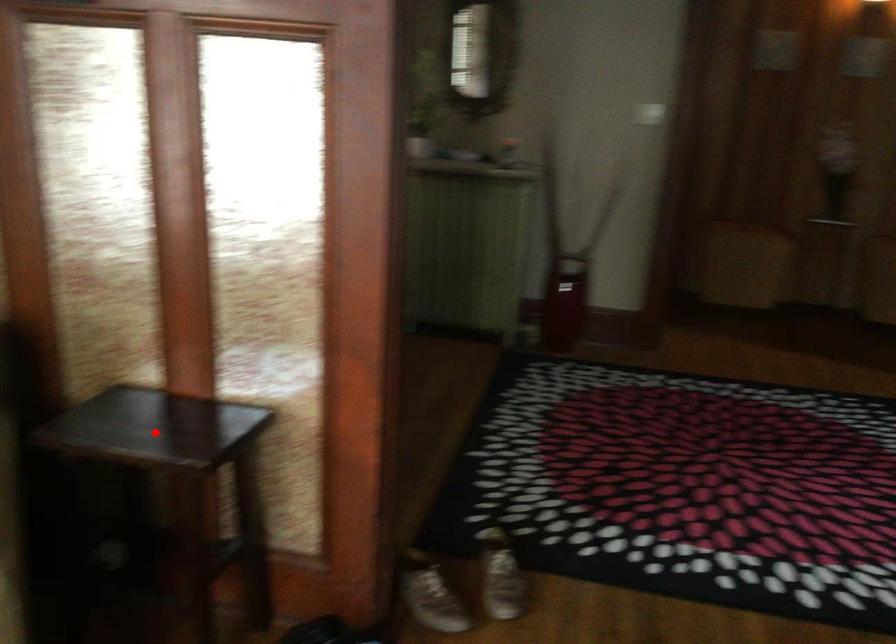
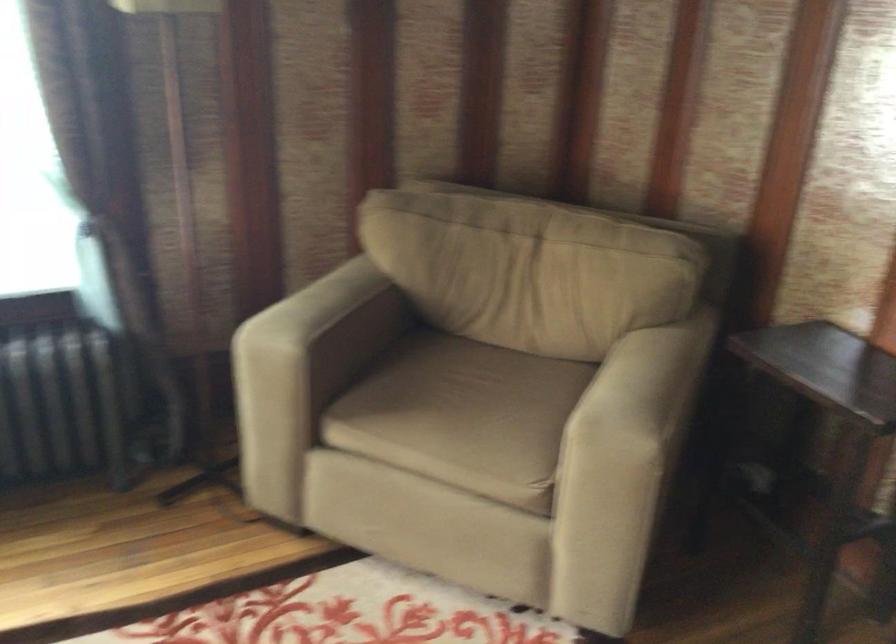
Question: I am providing you with two images of the same scene from different viewpoints. A red point is marked on the first image. At the location where the point appears in image 1, is it still visible in image 2?

Choices:
 (A) Yes
 (B) No

Answer: (A)